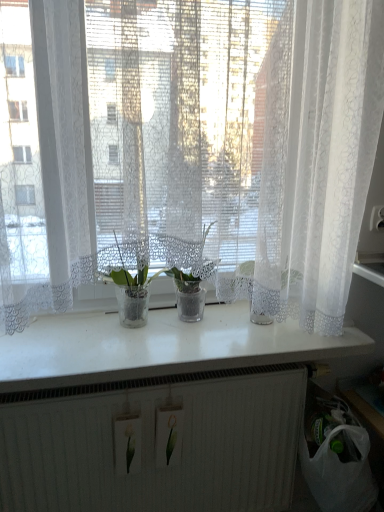
Question: From the image's perspective, is white lace curtain at center beneath translucent glass pot at center, marked as the second houseplant in a left-to-right arrangement?

Choices:
 (A) no
 (B) yes

Answer: (A)

Question: Considering the relative positions of white lace curtain at center and translucent glass pot at center, marked as the second houseplant in a left-to-right arrangement, in the image provided, is white lace curtain at center behind translucent glass pot at center, marked as the second houseplant in a left-to-right arrangement,?

Choices:
 (A) yes
 (B) no

Answer: (B)

Question: Is white lace curtain at center turned away from translucent glass pot at center, the first houseplant from the right?

Choices:
 (A) no
 (B) yes

Answer: (B)

Question: From a real-world perspective, is white lace curtain at center located higher than translucent glass pot at center, marked as the second houseplant in a left-to-right arrangement?

Choices:
 (A) no
 (B) yes

Answer: (B)

Question: Would you say translucent glass pot at center, the first houseplant from the right, is part of white lace curtain at center's contents?

Choices:
 (A) no
 (B) yes

Answer: (A)

Question: Does white lace curtain at center have a smaller size compared to translucent glass pot at center, the first houseplant from the right?

Choices:
 (A) yes
 (B) no

Answer: (B)

Question: Is clear glass vase at center, the 1th houseplant when ordered from left to right, bigger than white glossy counter top at center?

Choices:
 (A) no
 (B) yes

Answer: (A)

Question: Does clear glass vase at center, acting as the second houseplant starting from the right, appear on the left side of white glossy counter top at center?

Choices:
 (A) yes
 (B) no

Answer: (A)

Question: Can you confirm if clear glass vase at center, the 1th houseplant when ordered from left to right, is thinner than white glossy counter top at center?

Choices:
 (A) no
 (B) yes

Answer: (B)

Question: Is clear glass vase at center, acting as the second houseplant starting from the right, located outside white glossy counter top at center?

Choices:
 (A) yes
 (B) no

Answer: (A)

Question: Is white glossy counter top at center surrounded by clear glass vase at center, acting as the second houseplant starting from the right?

Choices:
 (A) no
 (B) yes

Answer: (A)

Question: Can you confirm if clear glass vase at center, acting as the second houseplant starting from the right, is wider than white glossy counter top at center?

Choices:
 (A) yes
 (B) no

Answer: (B)

Question: From the image's perspective, would you say white glossy counter top at center is positioned over clear glass vase at center, the 1th houseplant when ordered from left to right?

Choices:
 (A) yes
 (B) no

Answer: (B)